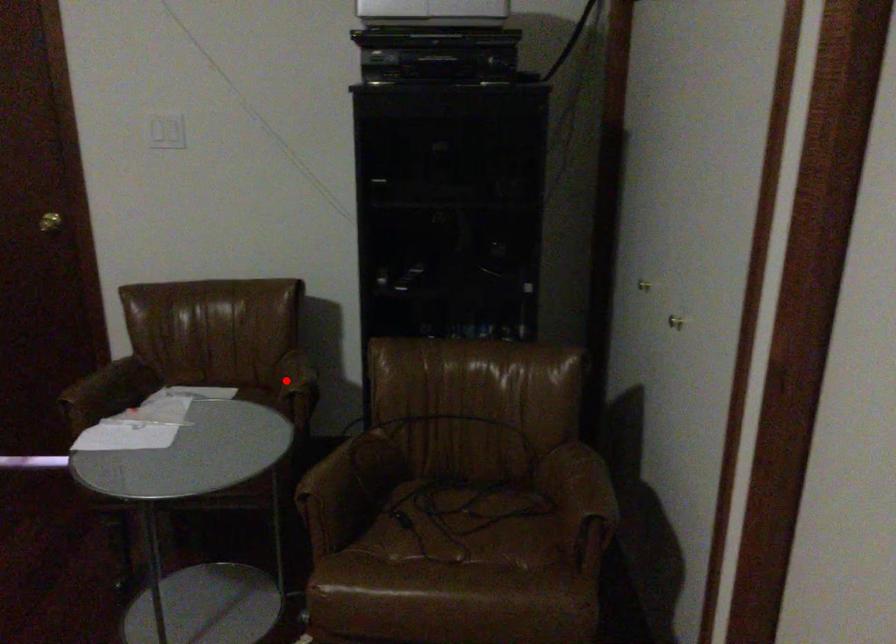
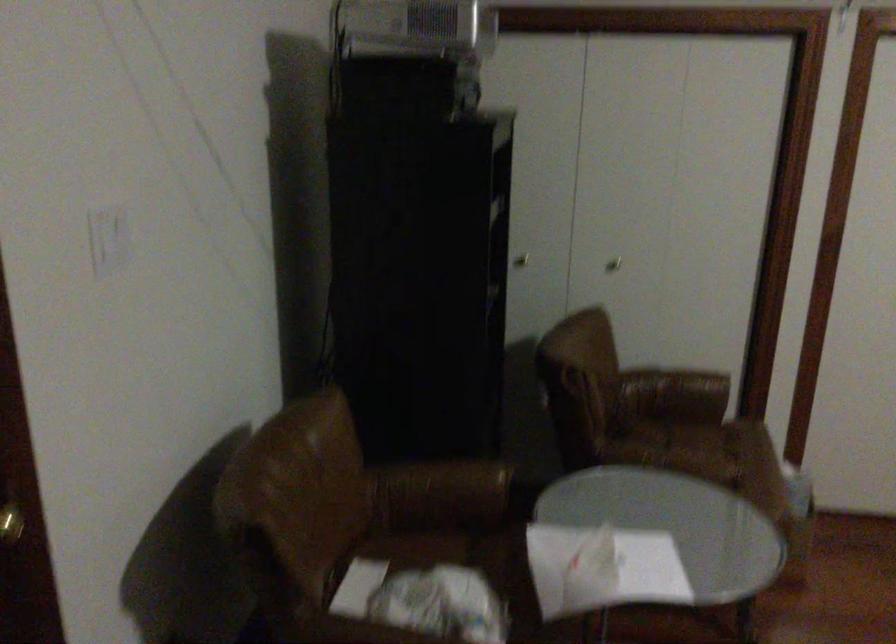
Where in the second image is the point corresponding to the highlighted location from the first image?

(442, 488)